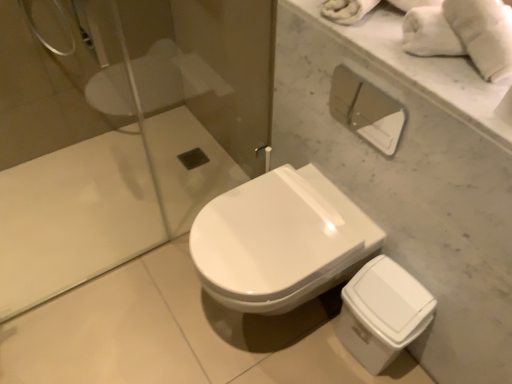
Question: In terms of size, does white glossy toilet at center appear bigger or smaller than white matte toilet paper at upper right?

Choices:
 (A) small
 (B) big

Answer: (B)

Question: Considering the positions of white glossy toilet at center and white matte toilet paper at upper right in the image, is white glossy toilet at center taller or shorter than white matte toilet paper at upper right?

Choices:
 (A) short
 (B) tall

Answer: (B)

Question: Considering the real-world distances, which object is closest to the white fluffy towel at upper right?

Choices:
 (A) white glossy toilet at center
 (B) white matte toilet paper at upper right

Answer: (A)

Question: Based on their relative distances, which object is nearer to the white fluffy towel at upper right?

Choices:
 (A) white glossy toilet at center
 (B) white matte toilet paper at upper right

Answer: (A)